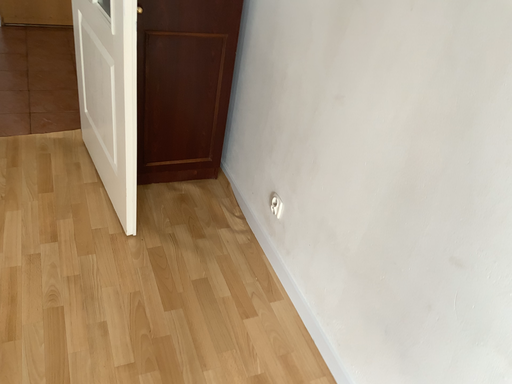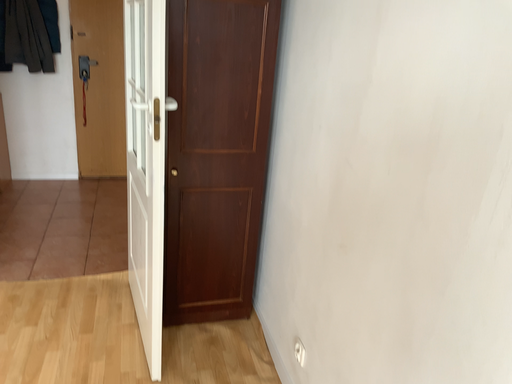
Question: How did the camera likely rotate when shooting the video?

Choices:
 (A) rotated upward
 (B) rotated downward

Answer: (A)